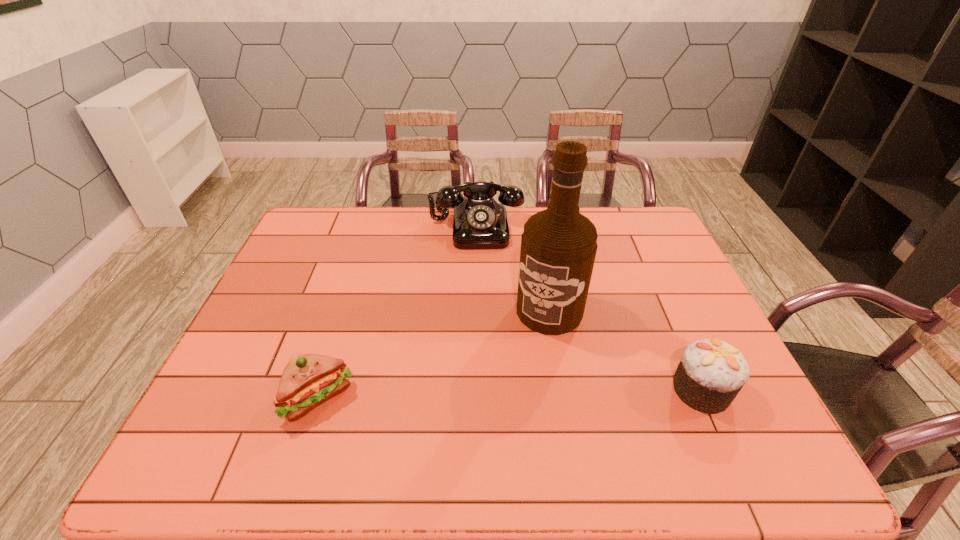
This screenshot has height=540, width=960. What are the coordinates of `vacant space situated on the dial of the farthest object` in the screenshot? It's located at (x=479, y=287).

I want to click on vacant space located on the dial of the farthest object, so click(479, 296).

Where is `vacant space located 0.100m on the dial of the farthest object`? The width and height of the screenshot is (960, 540). vacant space located 0.100m on the dial of the farthest object is located at coordinates (478, 269).

Find the location of a particular element. The height and width of the screenshot is (540, 960). object that is at the far edge is located at coordinates (479, 222).

Locate an element on the screen. The height and width of the screenshot is (540, 960). sandwich that is positioned at the near edge is located at coordinates (308, 380).

Where is `cupcake present at the near edge`? This screenshot has width=960, height=540. cupcake present at the near edge is located at coordinates (711, 373).

At what (x,y) coordinates should I click in order to perform the action: click on object at the right edge. Please return your answer as a coordinate pair (x, y). The image size is (960, 540). Looking at the image, I should click on (711, 373).

Locate an element on the screen. The width and height of the screenshot is (960, 540). object present at the near right corner is located at coordinates (711, 373).

What are the coordinates of `free space at the far edge of the desktop` in the screenshot? It's located at pos(603,241).

The image size is (960, 540). I want to click on free location at the near edge, so click(x=604, y=395).